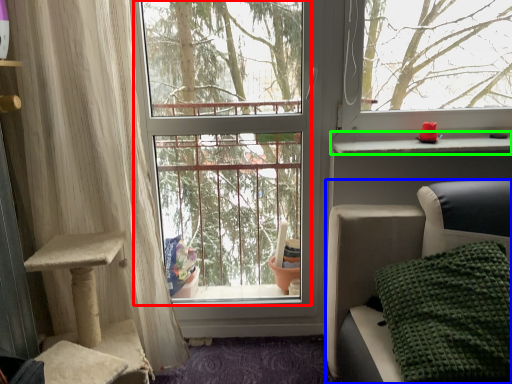
Question: Which object is the closest to the window screen (highlighted by a red box)? Choose among these: furniture (highlighted by a blue box) or window sill (highlighted by a green box).

Choices:
 (A) furniture
 (B) window sill

Answer: (A)